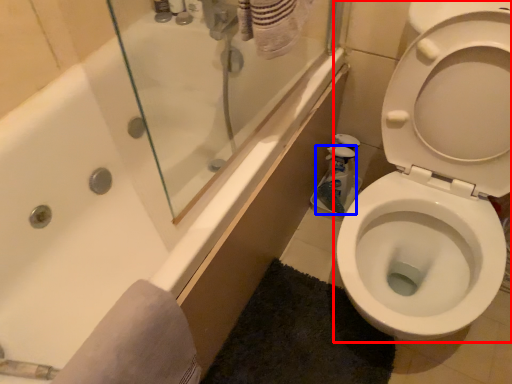
Question: Which object is closer to the camera taking this photo, toilet (highlighted by a red box) or cleaning product (highlighted by a blue box)?

Choices:
 (A) toilet
 (B) cleaning product

Answer: (A)